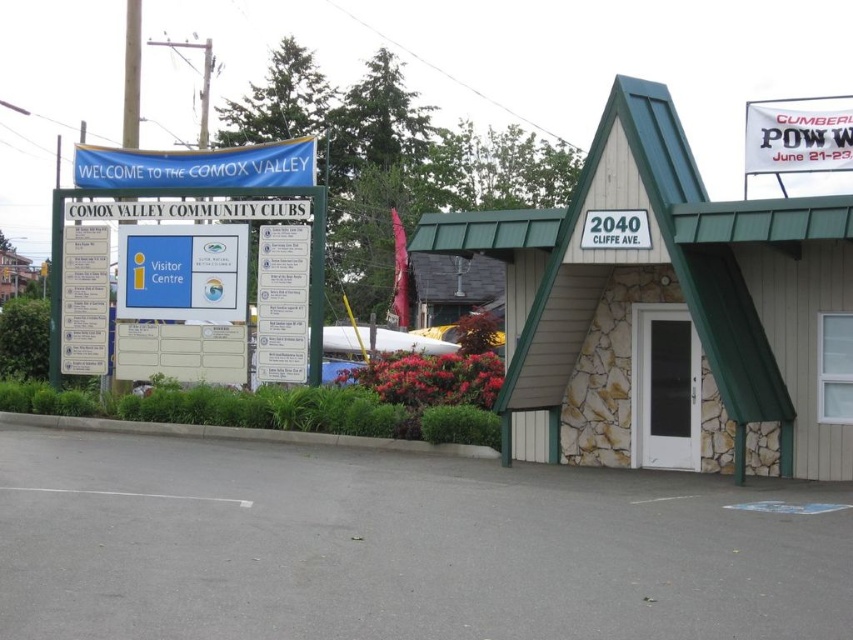
You are standing in front of the building at 2040 Cliff Ave. and notice two points marked on the signboard to your left. Which point, point (161, 264) or point (100, 308), is closer to you?

Point (161, 264) is closer to the viewer than point (100, 308).

You are a visitor standing in front of the building at 2040 Cliff Ave. You see a blue plastic sign at upper left and a white paper sign at center. Which sign is taller?

The white paper sign at center is taller than the blue plastic sign at upper left.